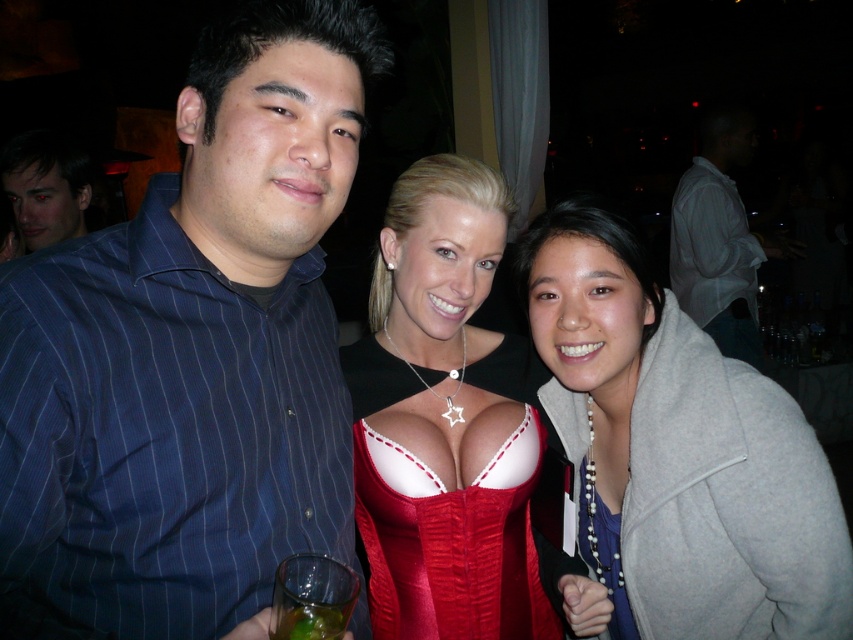
You are a photographer at the event and want to capture a closeup of the red satin corset at center. The camera you are using has a minimum focusing distance of 1 meter. Can you take the closeup without moving the subject?

The red satin corset at center is 1.09 meters from viewer, so yes, the camera can focus on it since the distance is slightly over the minimum focusing requirement of 1 meter.

Based on the coordinates provided, which object is located at point (x=677, y=451) in the image?

The gray woolen coat at right is located at point (x=677, y=451).

You are a photographer adjusting lighting for a portrait. You need to ensure that the red satin corset at center and the smooth skin face at upper left are both well lit. Given their sizes, which object should you focus more light on to achieve balanced illumination?

The red satin corset at center is wider than the smooth skin face at upper left, so you should focus more light on the red satin corset at center to balance the illumination between the two objects.